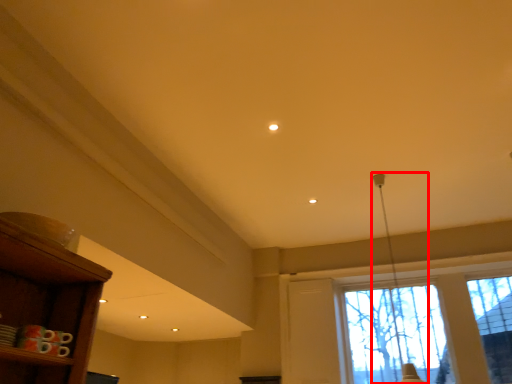
Question: Considering the relative positions of lamp (annotated by the red box) and window in the image provided, where is lamp (annotated by the red box) located with respect to the staircase?

Choices:
 (A) right
 (B) left

Answer: (B)